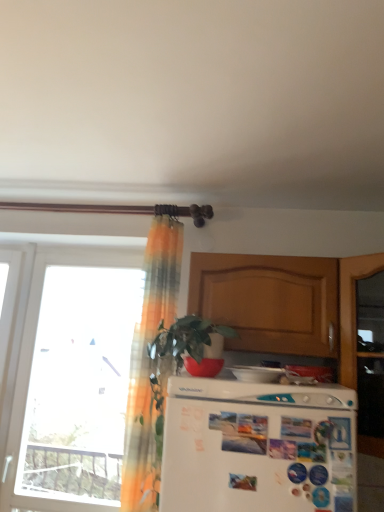
Question: Is wooden cabinet at upper center in front of or behind white glossy refrigerator at lower center, which appears as the first appliance when viewed from the back, in the image?

Choices:
 (A) behind
 (B) front

Answer: (A)

Question: Is wooden cabinet at upper center to the left or to the right of white glossy refrigerator at lower center, placed as the first appliance when sorted from right to left, in the image?

Choices:
 (A) left
 (B) right

Answer: (A)

Question: Estimate the real-world distances between objects in this image. Which object is farther from the white glossy refrigerator at lower center, which appears as the first appliance when viewed from the back?

Choices:
 (A) white matte refrigerator at center
 (B) translucent orange curtain at upper left
 (C) wooden cabinet at upper center
 (D) transparent glass window at left
 (E) white glossy refrigerator at center, which is the 1th appliance in left-to-right order

Answer: (D)

Question: Based on their relative distances, which object is farther from the translucent orange curtain at upper left?

Choices:
 (A) transparent glass window at left
 (B) wooden cabinet at upper center
 (C) white glossy refrigerator at lower center, which appears as the first appliance when viewed from the back
 (D) white glossy refrigerator at center, which is the 1th appliance in left-to-right order
 (E) white matte refrigerator at center

Answer: (A)